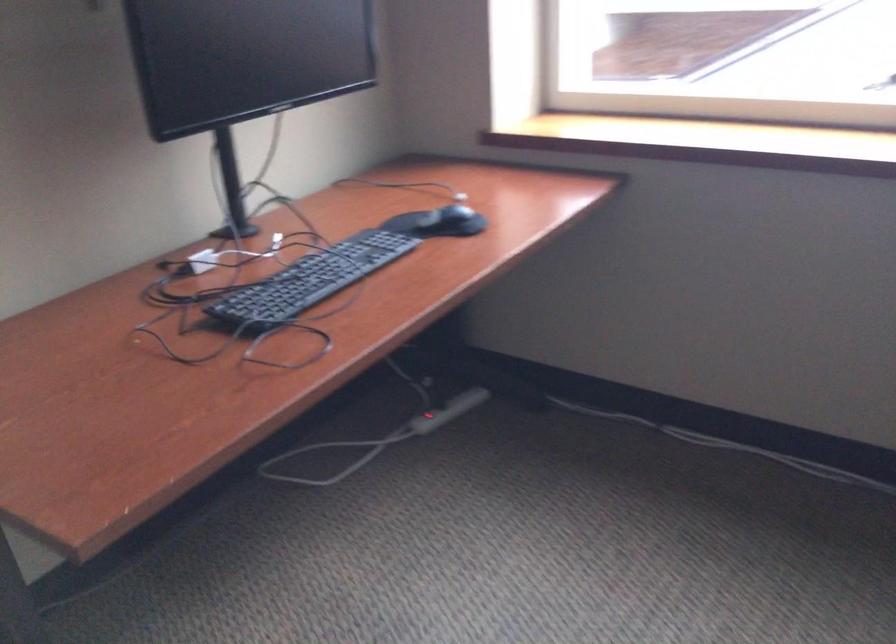
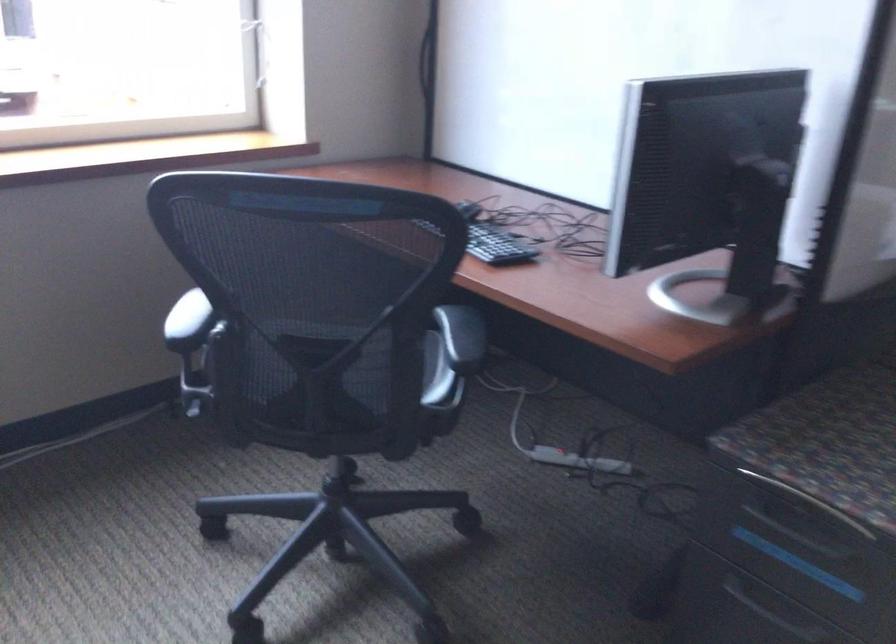
Question: The first image is from the beginning of the video and the second image is from the end. How did the camera likely rotate when shooting the video?

Choices:
 (A) Left
 (B) Right
 (C) Up
 (D) Down

Answer: (B)